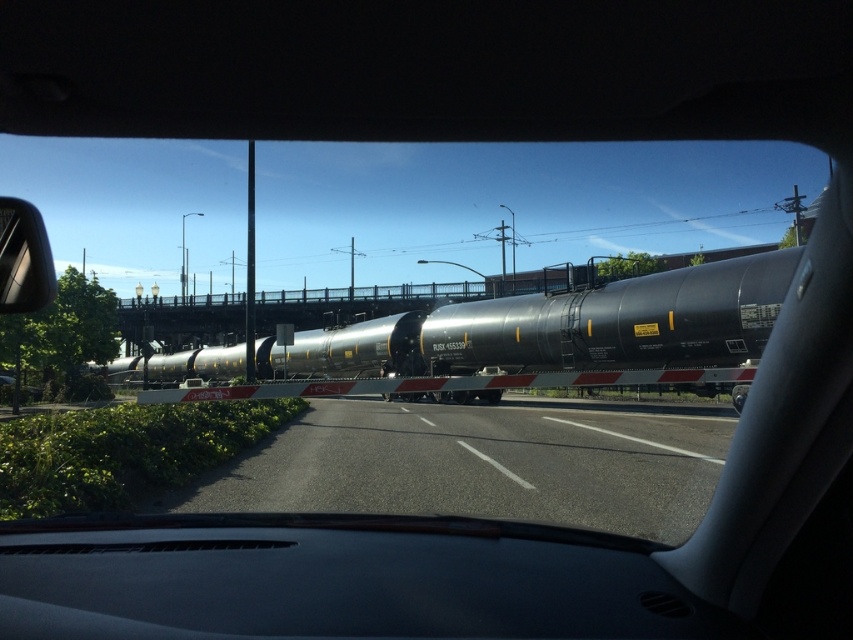
Question: Is black asphalt highway at center smaller than matte black tank car at center?

Choices:
 (A) yes
 (B) no

Answer: (A)

Question: Can you confirm if matte black tank car at center is bigger than silver metallic side mirror at left?

Choices:
 (A) yes
 (B) no

Answer: (A)

Question: Considering the real-world distances, which object is closest to the matte black tank car at center?

Choices:
 (A) black asphalt highway at center
 (B) silver metallic side mirror at left

Answer: (A)

Question: Which object is closer to the camera taking this photo?

Choices:
 (A) black asphalt highway at center
 (B) silver metallic side mirror at left

Answer: (B)

Question: Can you confirm if black asphalt highway at center is positioned above matte black tank car at center?

Choices:
 (A) yes
 (B) no

Answer: (A)

Question: Which object is positioned closest to the black asphalt highway at center?

Choices:
 (A) silver metallic side mirror at left
 (B) matte black tank car at center

Answer: (B)